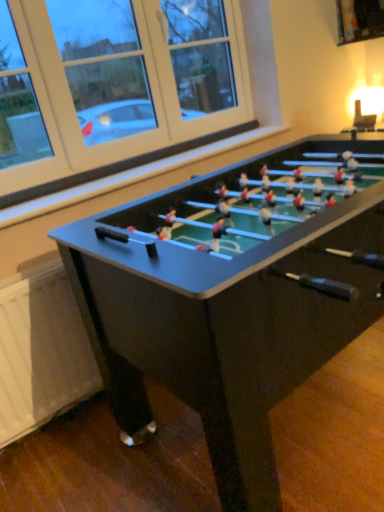
Describe the element at coordinates (231, 297) in the screenshot. I see `matte black foosball table at center` at that location.

What are the coordinates of `matte black foosball table at center` in the screenshot? It's located at (231, 297).

Locate an element on the screen. The width and height of the screenshot is (384, 512). matte black foosball table at center is located at coordinates (231, 297).